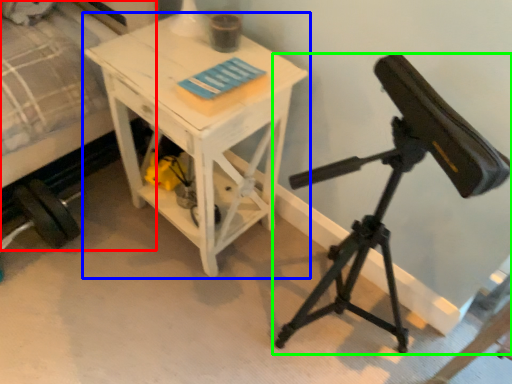
Question: Based on their relative distances, which object is nearer to bed (highlighted by a red box)? Choose from table (highlighted by a blue box) and tripod (highlighted by a green box).

Choices:
 (A) table
 (B) tripod

Answer: (A)